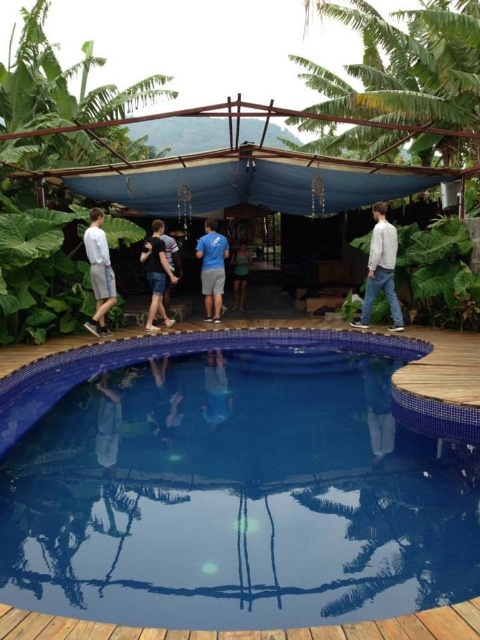
You are a lifeguard standing at the edge of the blue mosaic tile swimming pool at center. You notice someone wearing dark blue jeans at center approaching the pool. Considering the distance between the pool and the person, can you safely reach them within 3 seconds if you start running immediately?

The distance between the blue mosaic tile swimming pool at center and the dark blue jeans at center is 7.42 feet. Assuming an average running speed of about 10 feet per second, the lifeguard can cover the distance in approximately 0.74 seconds, which is well within the 3 seconds timeframe. Therefore, the lifeguard can safely reach them in time.

What are the coordinates of the green leafy palm tree at upper center in the image?

The coordinates of the green leafy palm tree at upper center are at point (x=406, y=65).

You are standing at the edge of the swimming pool and want to take a photo of both the point at coordinates (x=459, y=369) and the point at (x=156, y=304). Based on their positions, which point will appear larger in your camera view?

Point (x=459, y=369) is closer to the camera than point (x=156, y=304), so it will appear larger in the photo.